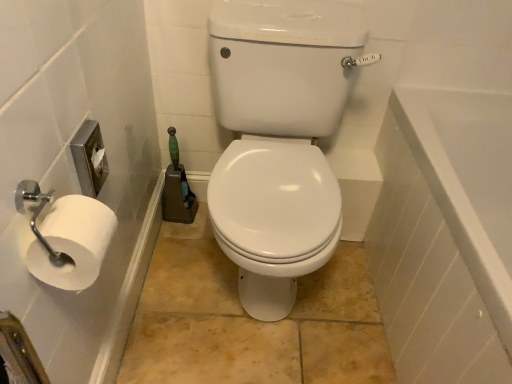
Question: Is white glossy toilet seat at center bigger than white matte toilet paper at left?

Choices:
 (A) yes
 (B) no

Answer: (A)

Question: Can you confirm if white glossy toilet seat at center is shorter than white matte toilet paper at left?

Choices:
 (A) yes
 (B) no

Answer: (B)

Question: Are white glossy toilet seat at center and white matte toilet paper at left beside each other?

Choices:
 (A) no
 (B) yes

Answer: (A)

Question: Does white glossy toilet seat at center turn towards white matte toilet paper at left?

Choices:
 (A) yes
 (B) no

Answer: (B)

Question: From the image's perspective, is white glossy toilet seat at center under white matte toilet paper at left?

Choices:
 (A) no
 (B) yes

Answer: (A)

Question: Looking at their shapes, would you say white matte toilet paper at left is wider or thinner than white glossy bathtub at right?

Choices:
 (A) thin
 (B) wide

Answer: (A)

Question: From the image's perspective, relative to white glossy bathtub at right, is white matte toilet paper at left above or below?

Choices:
 (A) above
 (B) below

Answer: (A)

Question: Based on their sizes in the image, would you say white matte toilet paper at left is bigger or smaller than white glossy bathtub at right?

Choices:
 (A) big
 (B) small

Answer: (B)

Question: Is point (110, 218) positioned closer to the camera than point (403, 150)?

Choices:
 (A) closer
 (B) farther

Answer: (A)

Question: Would you say white glossy bathtub at right is inside or outside white glossy toilet seat at center?

Choices:
 (A) outside
 (B) inside

Answer: (A)

Question: From the image's perspective, is white glossy bathtub at right located above or below white glossy toilet seat at center?

Choices:
 (A) above
 (B) below

Answer: (B)

Question: Considering the relative positions of white glossy bathtub at right and white glossy toilet seat at center in the image provided, is white glossy bathtub at right to the left or to the right of white glossy toilet seat at center?

Choices:
 (A) left
 (B) right

Answer: (B)

Question: From a real-world perspective, is white glossy bathtub at right positioned above or below white glossy toilet seat at center?

Choices:
 (A) below
 (B) above

Answer: (A)

Question: From the image's perspective, is white glossy bathtub at right positioned above or below white matte toilet paper at left?

Choices:
 (A) below
 (B) above

Answer: (A)

Question: In the image, is white glossy bathtub at right on the left side or the right side of white matte toilet paper at left?

Choices:
 (A) right
 (B) left

Answer: (A)